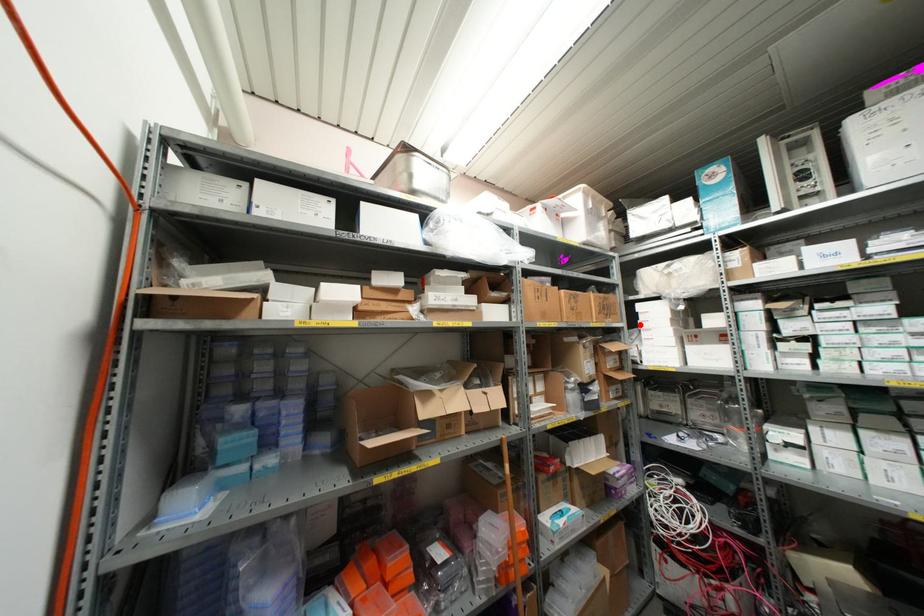
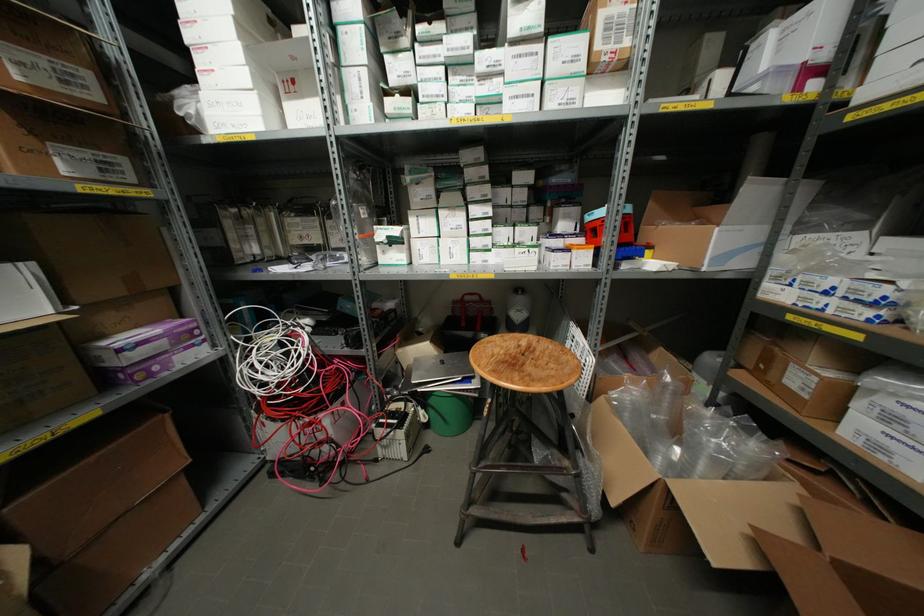
In the second image, find the point that corresponds to the highlighted location in the first image.

(188, 36)